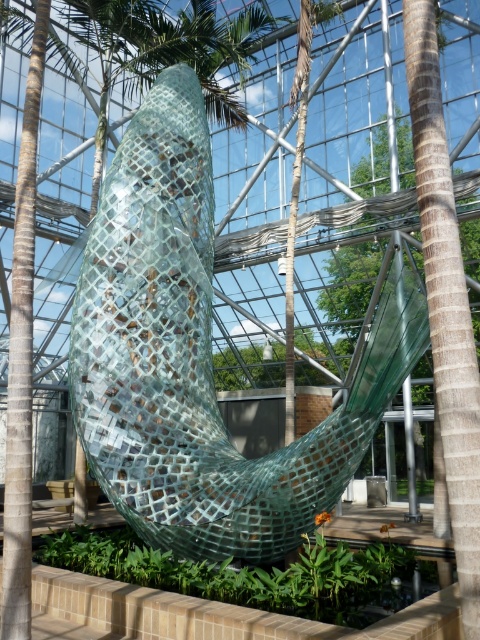
You are an architect designing a new exhibition space. You need to place a new light fixture between the transparent glass sculpture at center and the green textured glass at right. Considering their sizes, where should the light fixture be placed to ensure it doesn

The transparent glass sculpture at center is larger than the green textured glass at right. To maintain balance, the light fixture should be placed closer to the green textured glass at right to compensate for its smaller size.

You are standing in the greenhouse and want to take a closer look at the transparent glass sculpture at center. If your maximum comfortable viewing distance is 6 meters, can you comfortably view the sculpture from where you are standing?

The distance between you and the transparent glass sculpture at center is 5.82 meters, which is within your maximum comfortable viewing distance of 6 meters. Therefore, you can comfortably view the sculpture from your current position.

You are standing in the greenhouse and want to take a photo of the transparent glass sculpture at center. If you are positioned at point 0.5, 0.5, which direction should you move to get a better view?

Since the transparent glass sculpture at center is located at point (199, 358), you should move slightly to the right and down from your current position at (240, 320) to align with the sculpture for a better view.